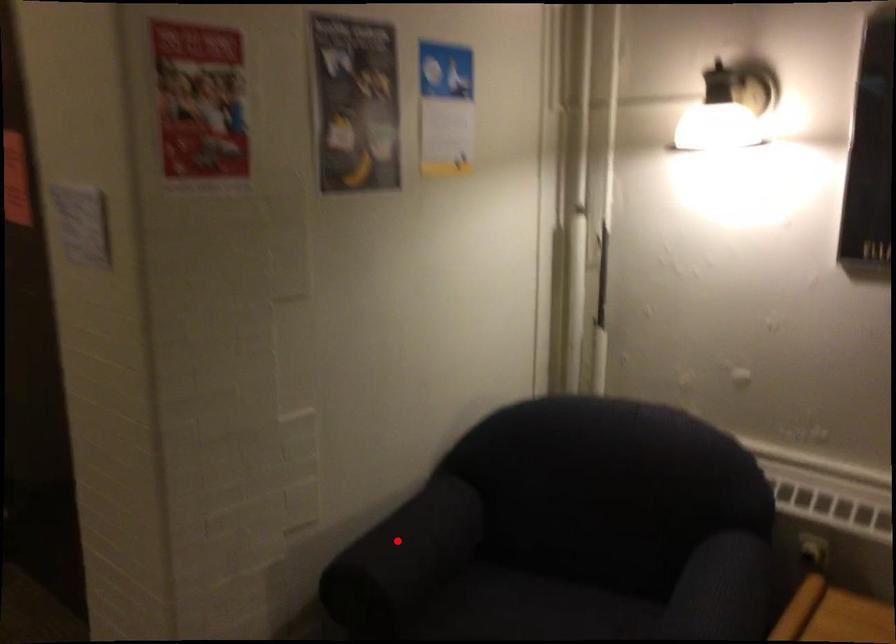
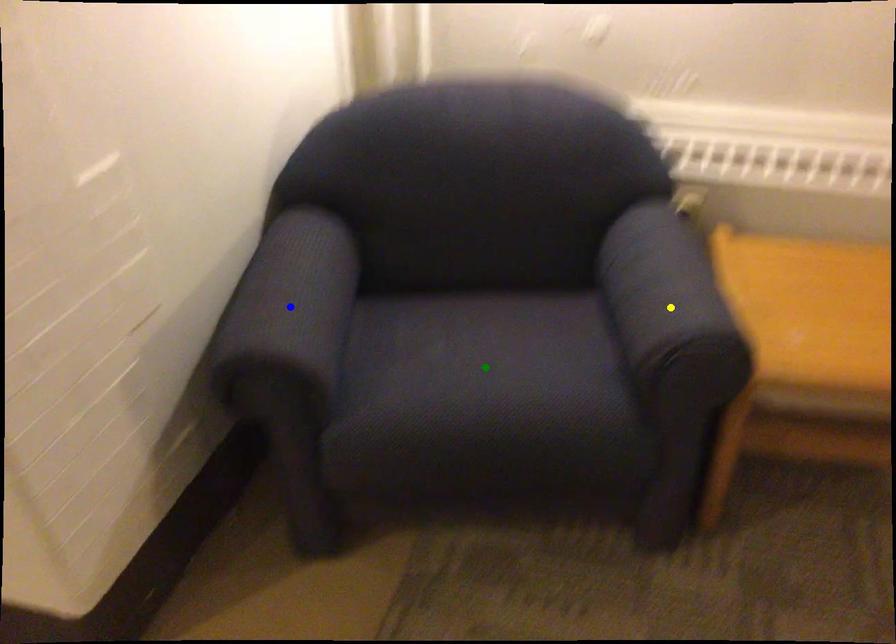
Question: I am providing you with two images of the same scene from different viewpoints. A red point is marked on the first image. You are given multiple points on the second image. Which mark in image 2 goes with the point in image 1?

Choices:
 (A) green point
 (B) yellow point
 (C) blue point

Answer: (C)